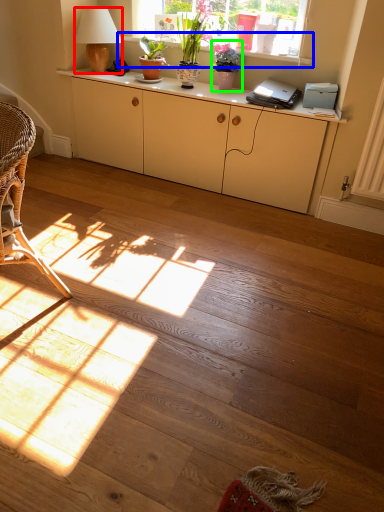
Question: Based on their relative distances, which object is farther from lamp (highlighted by a red box)? Choose from window sill (highlighted by a blue box) and houseplant (highlighted by a green box).

Choices:
 (A) window sill
 (B) houseplant

Answer: (A)